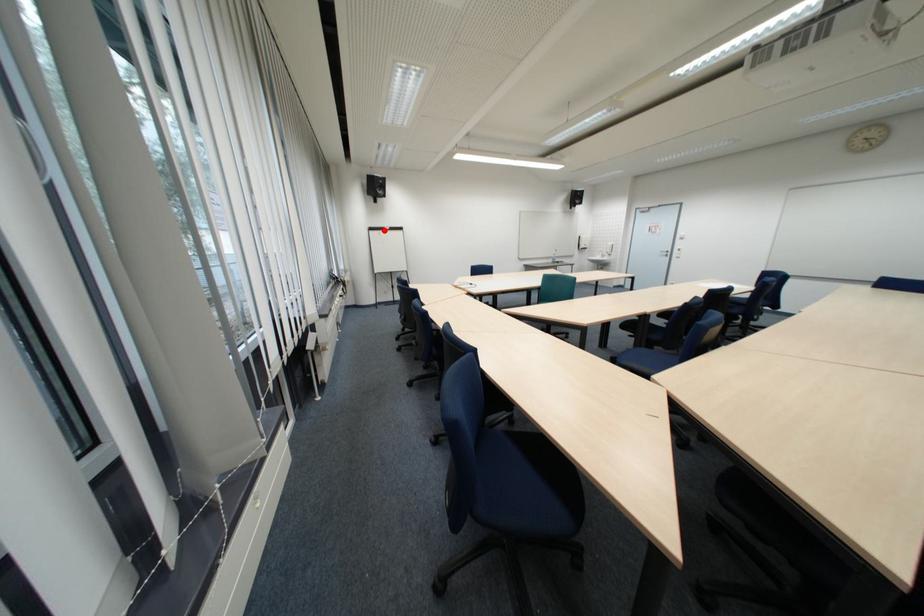
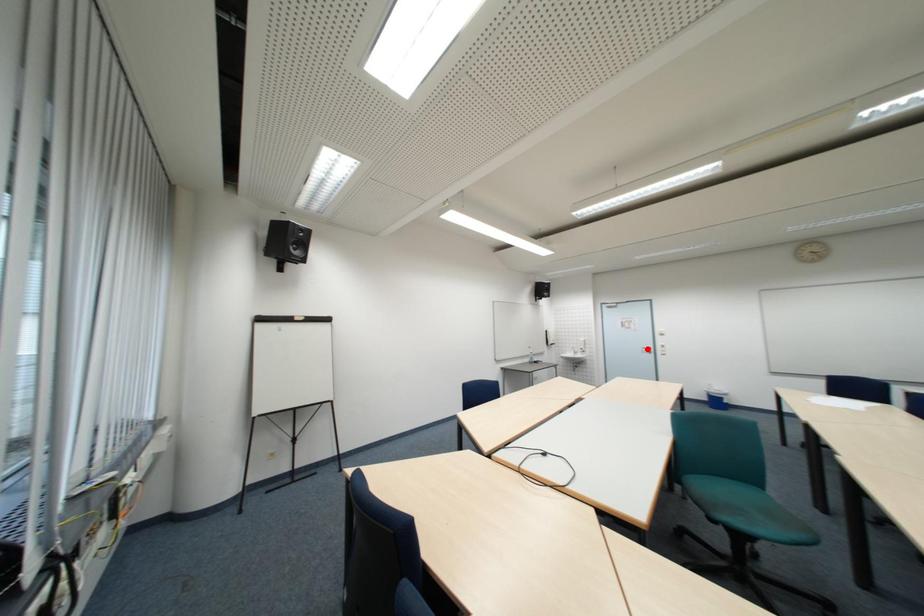
I am providing you with two images of the same scene from different viewpoints. A red point is marked on the first image and another point is marked on the second image. Is the red point in image1 aligned with the point shown in image2?

No